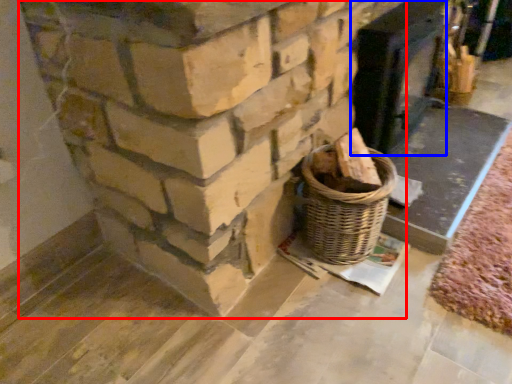
Question: Which of the following is the closest to the observer, fireplace (highlighted by a red box) or fireplace (highlighted by a blue box)?

Choices:
 (A) fireplace
 (B) fireplace

Answer: (A)